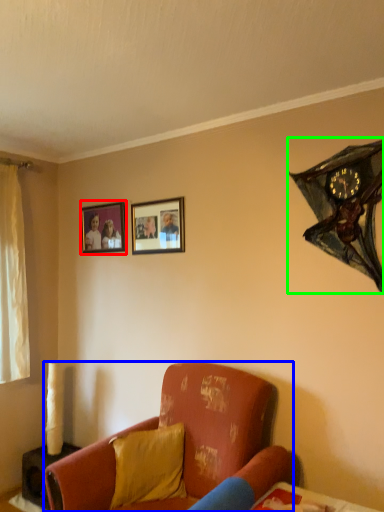
Question: Considering the real-world distances, which object is closest to picture frame (highlighted by a red box)? studio couch (highlighted by a blue box) or clock (highlighted by a green box).

Choices:
 (A) studio couch
 (B) clock

Answer: (A)